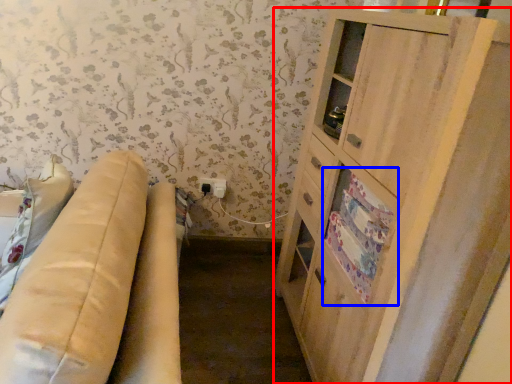
Question: Which of the following is the closest to the observer, cabinetry (highlighted by a red box) or drawer (highlighted by a blue box)?

Choices:
 (A) cabinetry
 (B) drawer

Answer: (A)